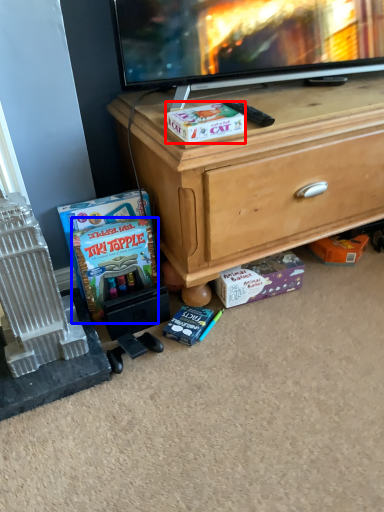
Question: Which of the following is the farthest to the observer, box (highlighted by a red box) or comic book (highlighted by a blue box)?

Choices:
 (A) box
 (B) comic book

Answer: (B)